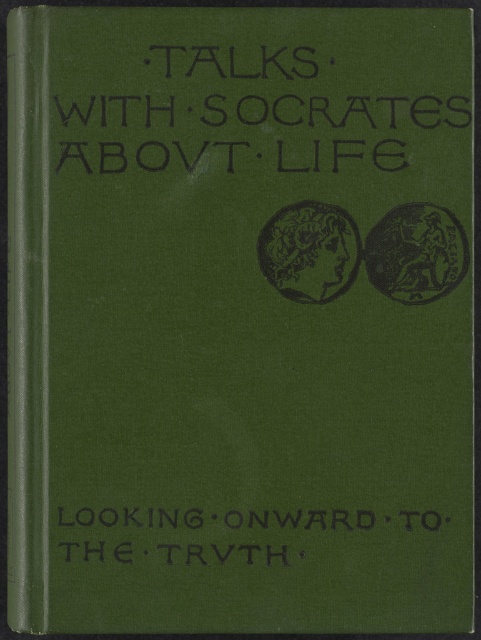
Who is positioned more to the left, black textured text at upper center or black textured text at bottom?

Positioned to the left is black textured text at bottom.

Based on the photo, is black textured text at upper center in front of black textured text at bottom?

That is False.

At what (x,y) coordinates should I click in order to perform the action: click on black textured text at upper center. Please return your answer as a coordinate pair (x, y). Image resolution: width=481 pixels, height=640 pixels. Looking at the image, I should click on (255, 108).

I want to click on black textured text at upper center, so click(255, 108).